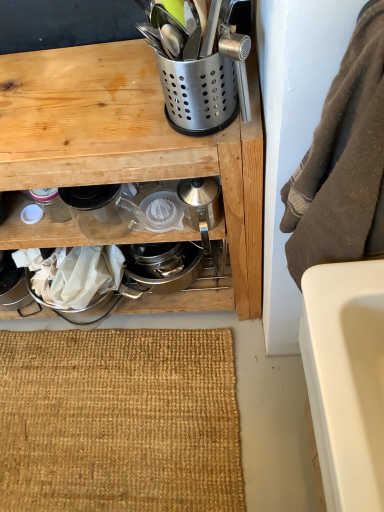
Image resolution: width=384 pixels, height=512 pixels. Identify the location of free space above metallic silver utensil holder at upper center (from a real-world perspective). (83, 93).